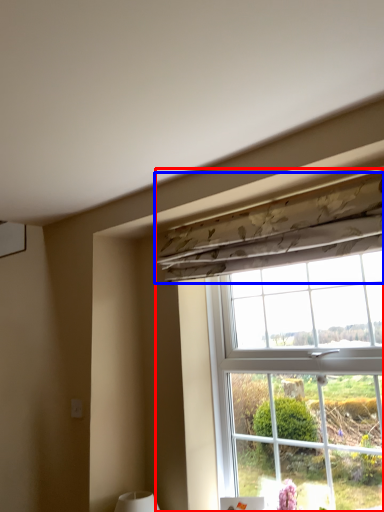
Question: Which object is further to the camera taking this photo, window (highlighted by a red box) or curtain (highlighted by a blue box)?

Choices:
 (A) window
 (B) curtain

Answer: (B)